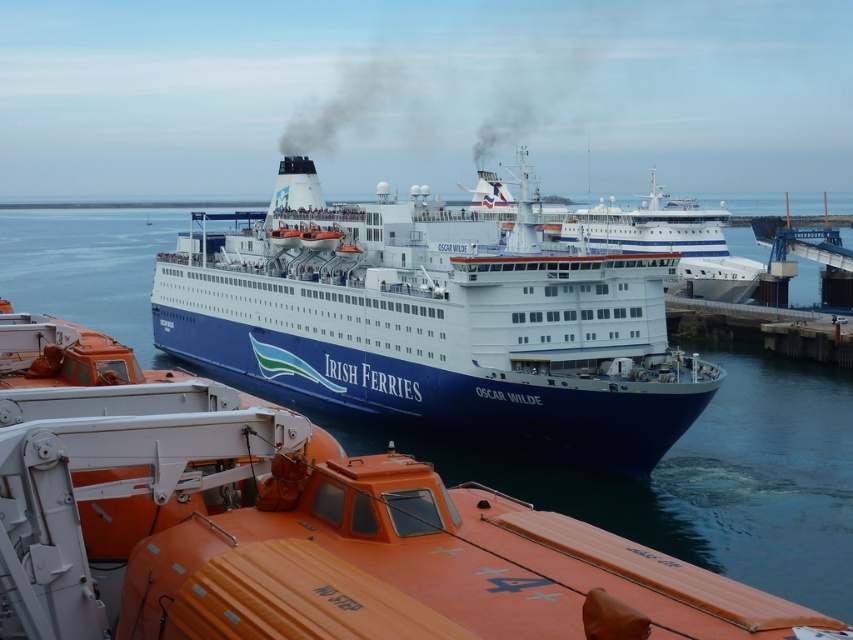
Question: Is blue water at center closer to the viewer compared to black smoke at center?

Choices:
 (A) no
 (B) yes

Answer: (B)

Question: Is blue water at center smaller than black smoke at center?

Choices:
 (A) no
 (B) yes

Answer: (A)

Question: Estimate the real-world distances between objects in this image. Which object is farther from the black smoke at center?

Choices:
 (A) blue water at center
 (B) blue matte ferry at center

Answer: (B)

Question: Among these objects, which one is nearest to the camera?

Choices:
 (A) black smoke at center
 (B) blue water at center
 (C) blue matte ferry at center

Answer: (B)

Question: Which point appears farthest from the camera in this image?

Choices:
 (A) (515, 88)
 (B) (666, 344)
 (C) (746, 228)

Answer: (A)

Question: Considering the relative positions of blue water at center and black smoke at center in the image provided, where is blue water at center located with respect to black smoke at center?

Choices:
 (A) right
 (B) left

Answer: (B)